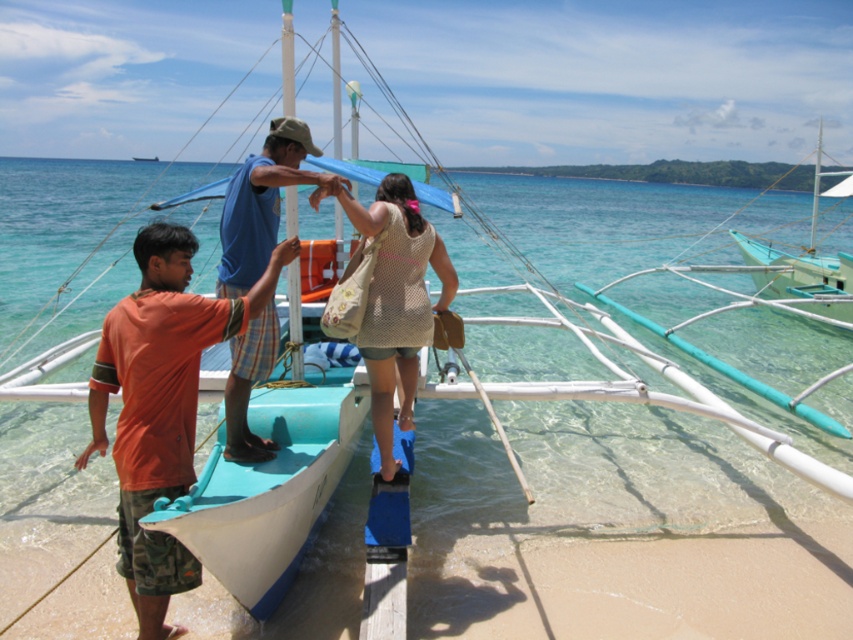
Question: Where is orange cotton shirt at center located in relation to beige crochet bag at center in the image?

Choices:
 (A) right
 (B) left

Answer: (B)

Question: Is orange cotton shirt at center above beige crochet bag at center?

Choices:
 (A) no
 (B) yes

Answer: (A)

Question: Can you confirm if blue plaid shorts at center is positioned to the left of teal wooden boat at right?

Choices:
 (A) no
 (B) yes

Answer: (B)

Question: Which of these objects is positioned closest to the blue plaid shorts at center?

Choices:
 (A) teal wooden boat at right
 (B) beige crochet bag at center
 (C) orange cotton shirt at center

Answer: (B)

Question: Which point is farther to the camera?

Choices:
 (A) blue plaid shorts at center
 (B) teal wooden boat at right
 (C) orange cotton shirt at center

Answer: (B)

Question: Which point is closer to the camera?

Choices:
 (A) (763, 284)
 (B) (167, 280)

Answer: (B)